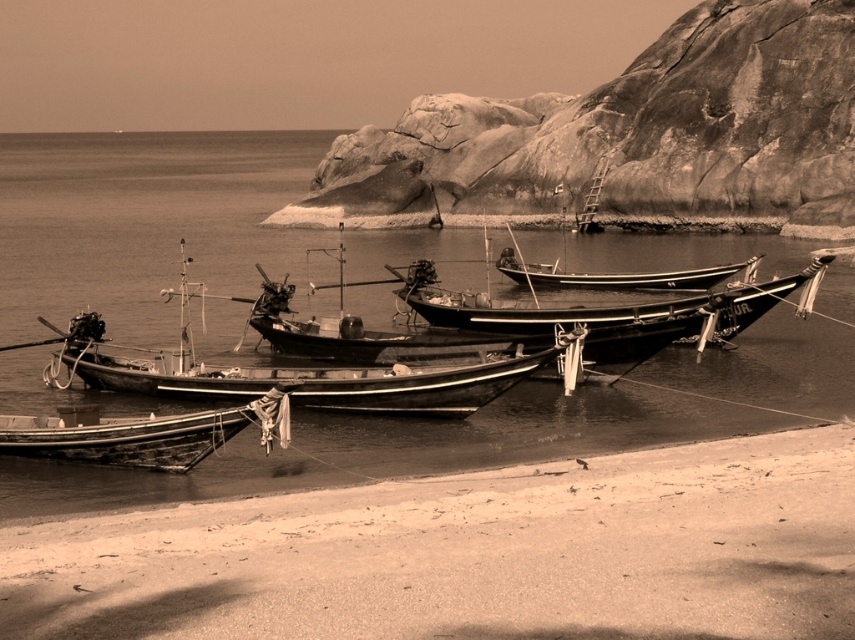
Question: Which of these objects is positioned closest to the rugged stone cliff at upper center?

Choices:
 (A) wooden boat at lower left
 (B) wooden boat at center
 (C) sepia water at center

Answer: (C)

Question: Does wooden boat at center appear on the left side of wooden boat at lower left?

Choices:
 (A) no
 (B) yes

Answer: (B)

Question: Is sepia water at center in front of wooden boat at lower left?

Choices:
 (A) no
 (B) yes

Answer: (B)

Question: Among these objects, which one is nearest to the camera?

Choices:
 (A) sepia water at center
 (B) wooden boat at center
 (C) wooden boat at lower left

Answer: (A)

Question: Is sepia water at center smaller than wooden boat at center?

Choices:
 (A) no
 (B) yes

Answer: (A)

Question: Which object is the farthest from the sepia water at center?

Choices:
 (A) wooden boat at lower left
 (B) rugged stone cliff at upper center

Answer: (A)